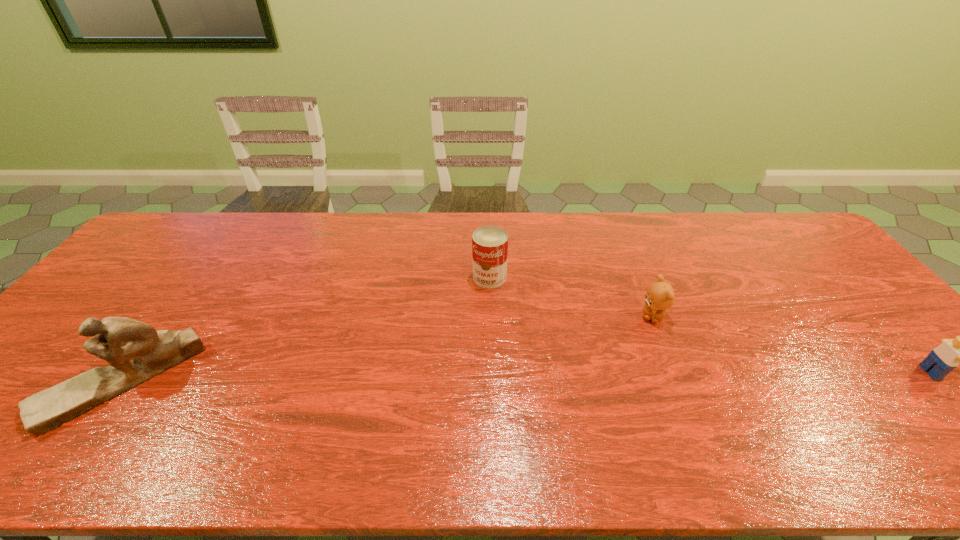
At what (x,y) coordinates should I click in order to perform the action: click on figurine. Please return your answer as a coordinate pair (x, y). This screenshot has width=960, height=540. Looking at the image, I should click on (136, 352).

The image size is (960, 540). I want to click on the tallest object, so click(x=136, y=352).

The image size is (960, 540). Identify the location of the farthest object. (489, 243).

Locate an element on the screen. The width and height of the screenshot is (960, 540). the second tallest object is located at coordinates (489, 243).

This screenshot has height=540, width=960. I want to click on the third nearest object, so click(x=660, y=295).

Locate an element on the screen. The height and width of the screenshot is (540, 960). the second object from right to left is located at coordinates (660, 295).

Locate an element on the screen. This screenshot has height=540, width=960. vacant region located on the front label of the can is located at coordinates (474, 301).

This screenshot has height=540, width=960. I want to click on free spot located on the front label of the can, so click(414, 393).

Find the location of a particular element. free space located 0.150m on the front label of the can is located at coordinates (461, 321).

The height and width of the screenshot is (540, 960). What are the coordinates of `blank space located on the face of the third object from left to right` in the screenshot? It's located at pos(638,347).